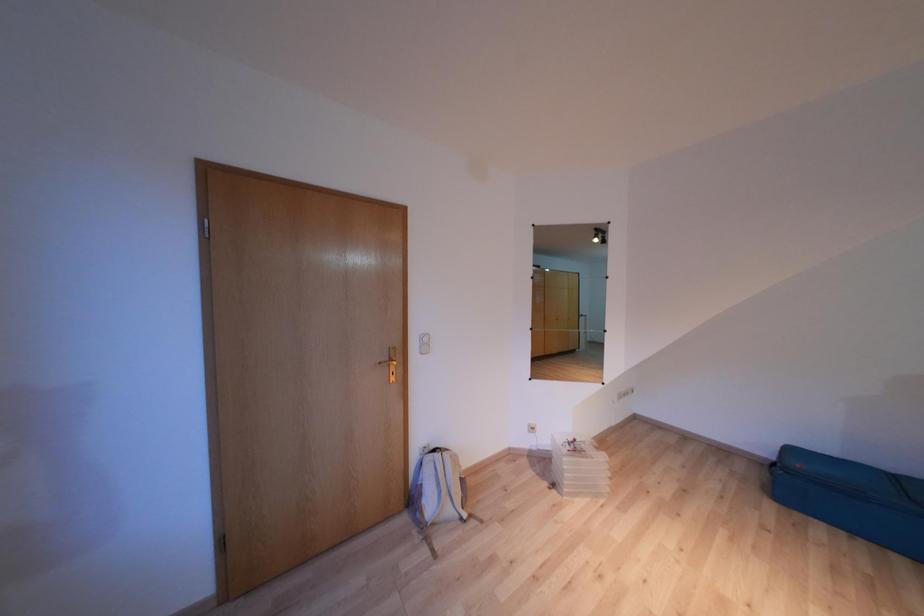
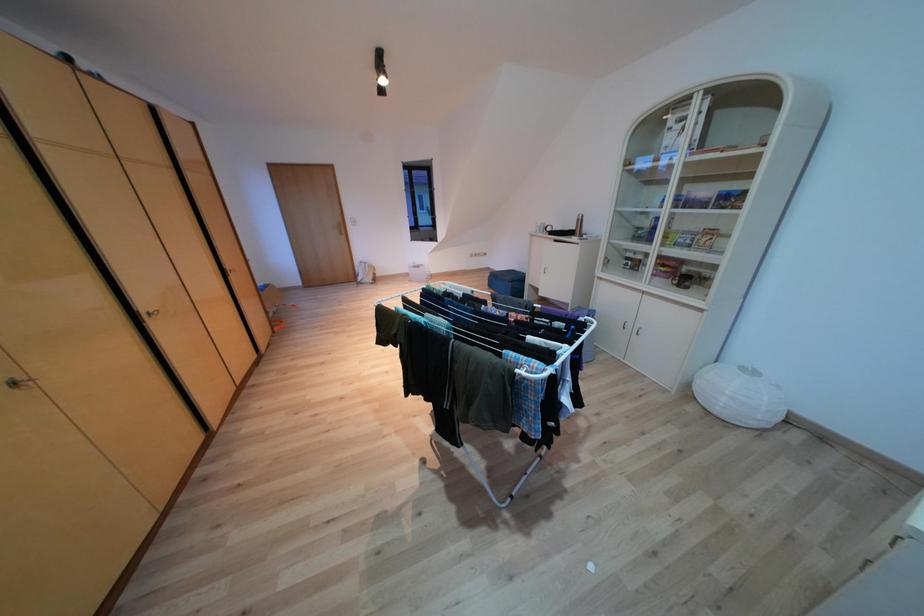
The images are taken continuously from a first-person perspective. In which direction are you moving?

The movement direction of the cameraman is right, backward.